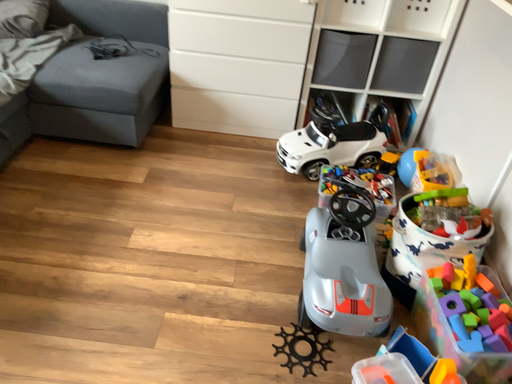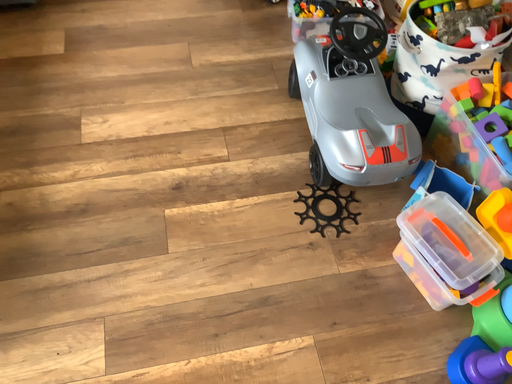
Question: How did the camera likely rotate when shooting the video?

Choices:
 (A) rotated right
 (B) rotated left

Answer: (A)